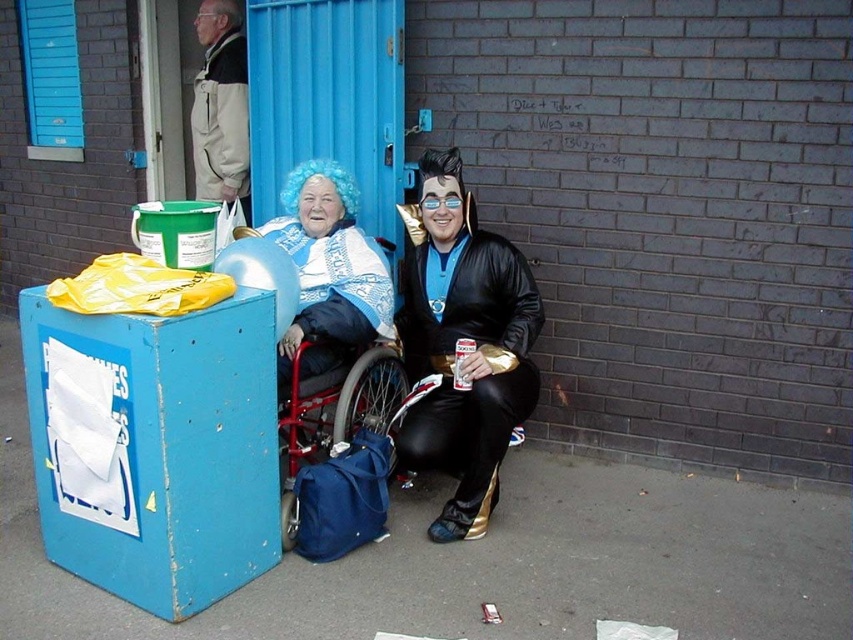
What are the coordinates of `blue fuzzy wig at upper center` in the screenshot? It's located at (329, 272).

Who is more distant from viewer, (337, 305) or (225, 10)?

The point (225, 10) is more distant.

Between point (386, 289) and point (242, 44), which one is positioned in front?

Point (386, 289)

Where is `blue fuzzy wig at upper center`? This screenshot has height=640, width=853. blue fuzzy wig at upper center is located at coordinates (329, 272).

Is concrete pavement at lower center above blue fuzzy wig at upper center?

Incorrect, concrete pavement at lower center is not positioned above blue fuzzy wig at upper center.

Can you confirm if concrete pavement at lower center is bigger than blue fuzzy wig at upper center?

Yes.

Between point (788, 550) and point (378, 337), which one is positioned in front?

Positioned in front is point (788, 550).

The height and width of the screenshot is (640, 853). Identify the location of concrete pavement at lower center. (485, 561).

Which is more to the left, concrete pavement at lower center or shiny black costume at center?

concrete pavement at lower center is more to the left.

Who is positioned more to the right, concrete pavement at lower center or shiny black costume at center?

shiny black costume at center is more to the right.

Which is in front, point (347, 620) or point (508, 369)?

Positioned in front is point (347, 620).

Identify the location of concrete pavement at lower center. (485, 561).